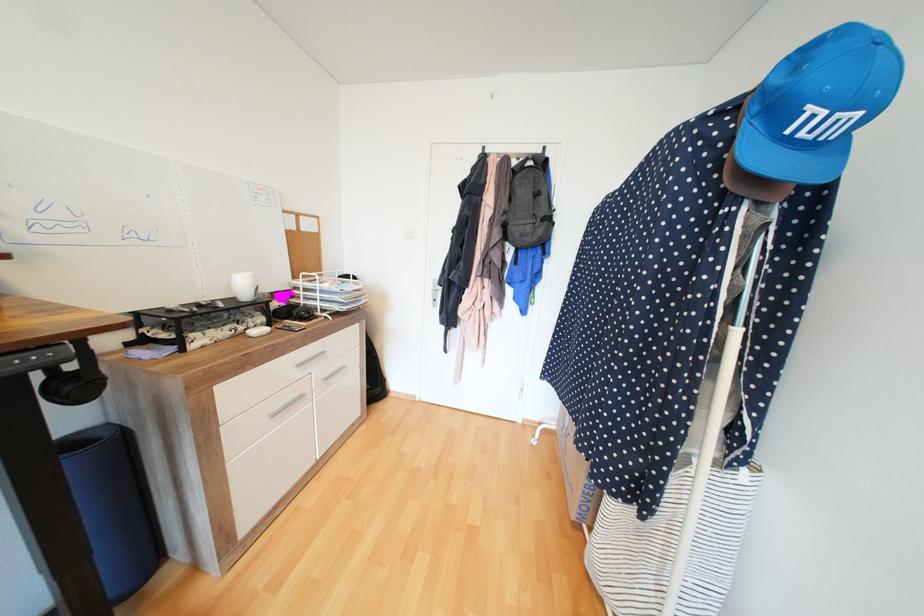
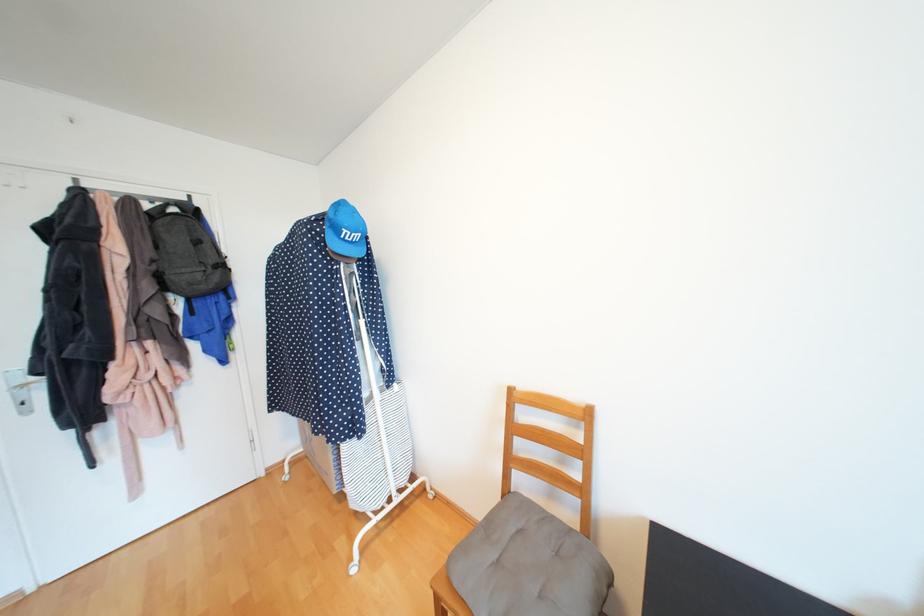
Where in the second image is the point corresponding to the point at 511,213 from the first image?

(160, 262)